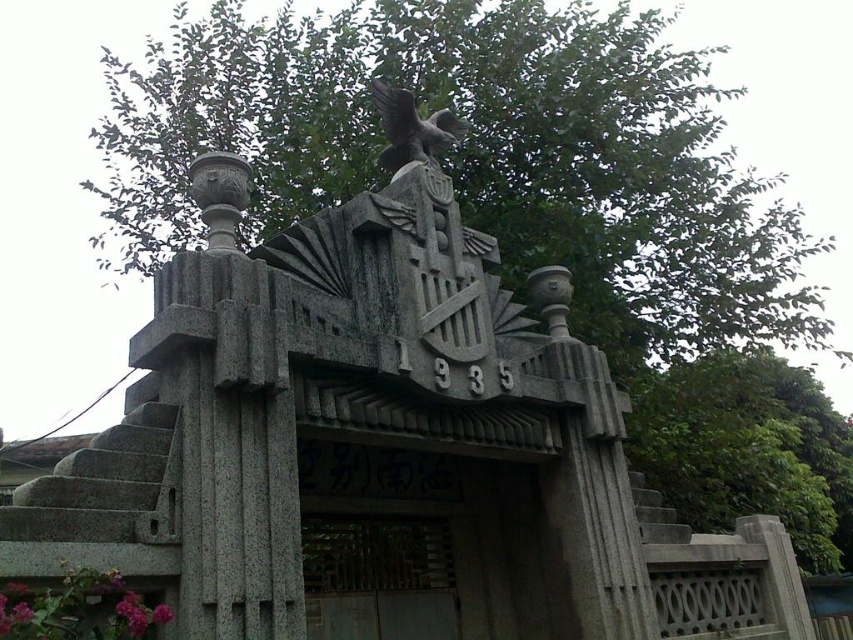
Who is more distant from viewer, (x=471, y=129) or (x=397, y=516)?

The point (x=471, y=129) is behind.

Is point (700, 228) positioned in front of point (310, 609)?

That is False.

Where is `green leafy tree at upper center`? green leafy tree at upper center is located at coordinates (479, 154).

Between green leafy tree at upper center and green leafy tree at upper right, which one appears on the left side from the viewer's perspective?

green leafy tree at upper center

Image resolution: width=853 pixels, height=640 pixels. Describe the element at coordinates (479, 154) in the screenshot. I see `green leafy tree at upper center` at that location.

Identify the location of green leafy tree at upper center. This screenshot has height=640, width=853. (479, 154).

Image resolution: width=853 pixels, height=640 pixels. Find the location of `green leafy tree at upper center`. green leafy tree at upper center is located at coordinates (479, 154).

Is wooden gate at center positioned at the back of gray stone eagle at upper center?

That is False.

Is point (352, 600) more distant than point (424, 140)?

No.

Who is more forward, (311, 637) or (438, 145)?

Point (311, 637)

The width and height of the screenshot is (853, 640). I want to click on wooden gate at center, so click(x=378, y=577).